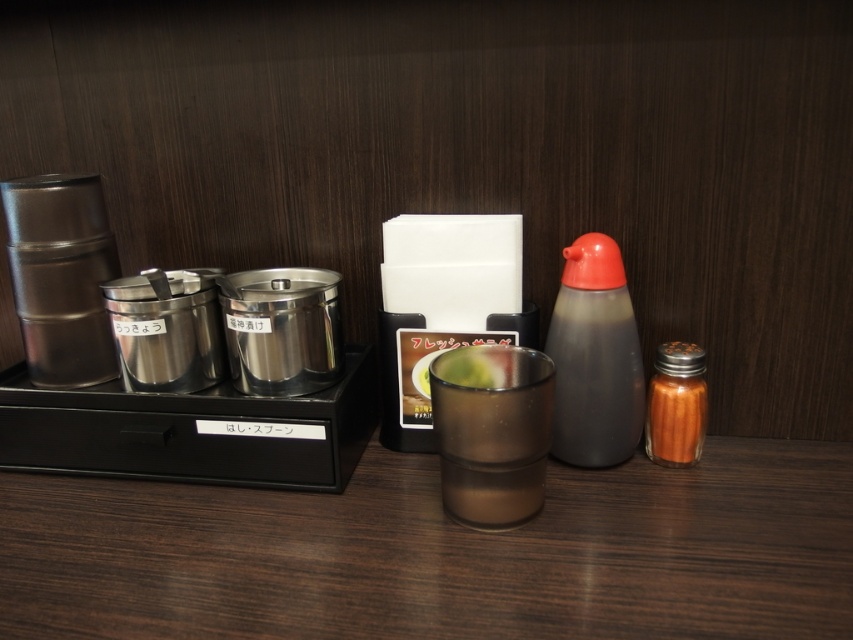
Can you confirm if smokey gray plastic bottle at center-right is smaller than orange glass spice shaker at right?

No, smokey gray plastic bottle at center-right is not smaller than orange glass spice shaker at right.

Consider the image. Does smokey gray plastic bottle at center-right appear under orange glass spice shaker at right?

Incorrect, smokey gray plastic bottle at center-right is not positioned below orange glass spice shaker at right.

Between point (612, 403) and point (660, 433), which one is positioned in front?

Positioned in front is point (612, 403).

Where is `smokey gray plastic bottle at center-right`? The height and width of the screenshot is (640, 853). smokey gray plastic bottle at center-right is located at coordinates [595, 356].

Who is shorter, translucent brown glass at center or smokey gray plastic bottle at center-right?

Standing shorter between the two is translucent brown glass at center.

Which is behind, point (531, 408) or point (604, 300)?

The point (604, 300) is behind.

What are the coordinates of `translucent brown glass at center` in the screenshot? It's located at (492, 432).

Does translucent brown glass at center come in front of orange glass spice shaker at right?

Yes.

How distant is translucent brown glass at center from orange glass spice shaker at right?

7.62 inches

Where is `translucent brown glass at center`? translucent brown glass at center is located at coordinates (492, 432).